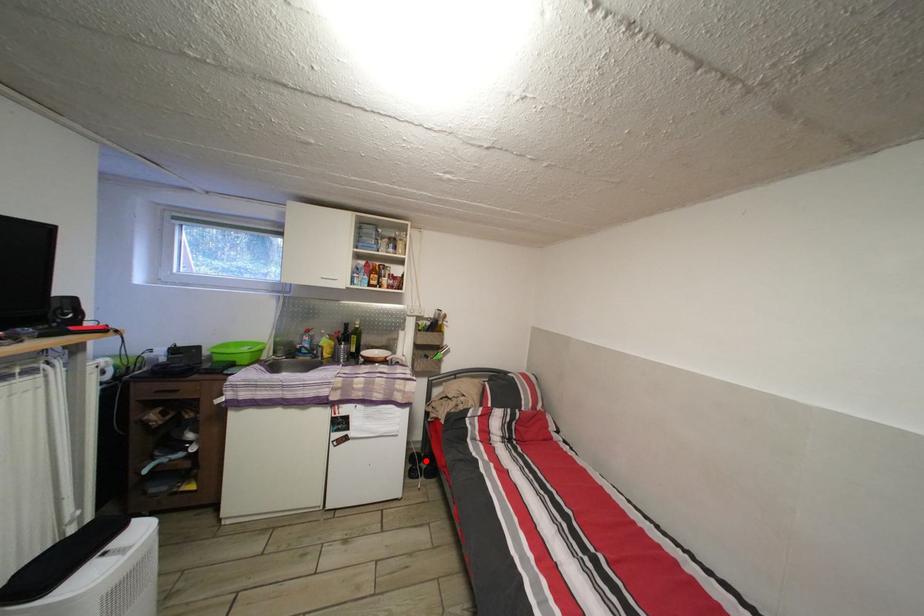
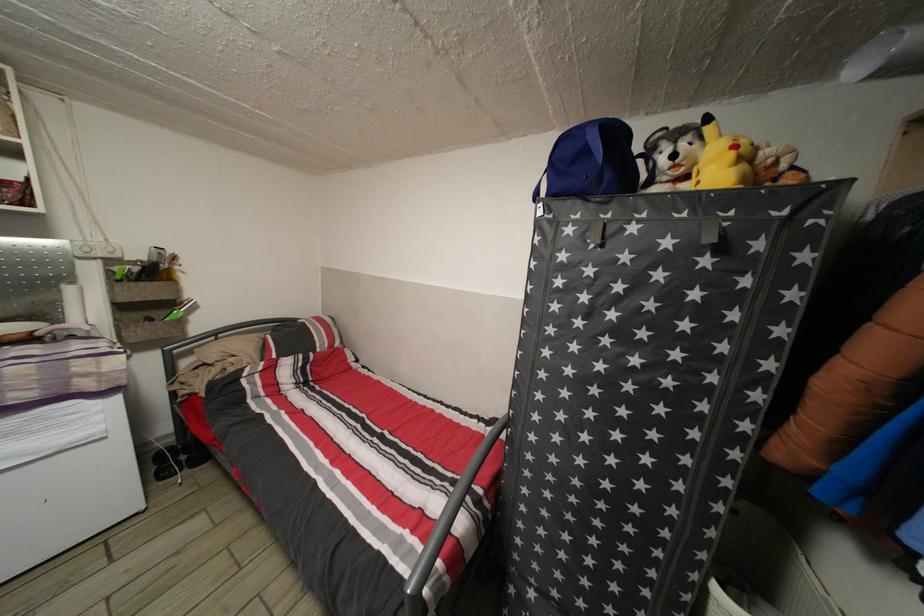
The point at the highlighted location is marked in the first image. Where is the corresponding point in the second image?

(177, 455)